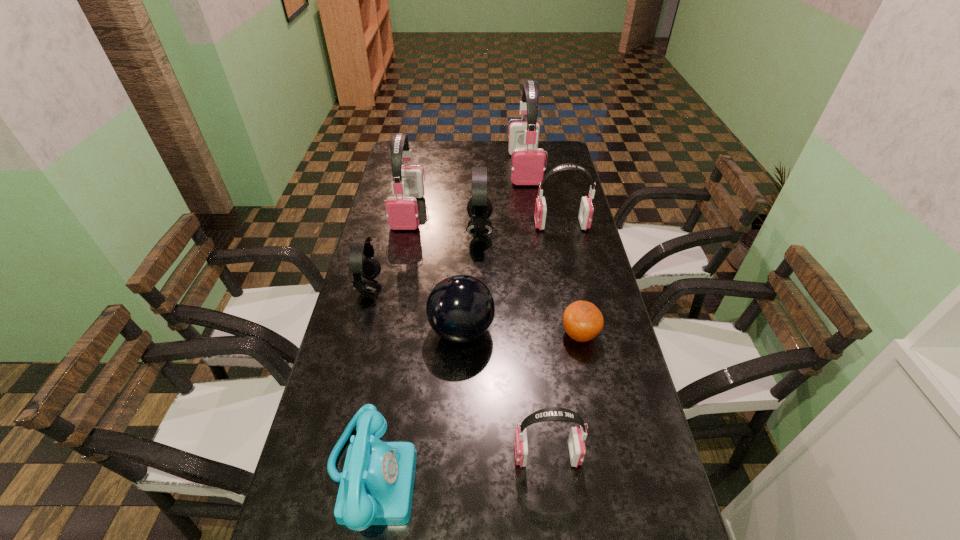
Find the location of a particular element. The height and width of the screenshot is (540, 960). vacant space at the left edge of the desktop is located at coordinates (337, 401).

In the image, there is a desktop. Identify the location of vacant space at the right edge. (611, 356).

Where is `free spot at the far left corner of the desktop`? The image size is (960, 540). free spot at the far left corner of the desktop is located at coordinates (410, 144).

Identify the location of free spot at the far right corner of the desktop. [x=556, y=167].

Identify the location of unoccupied area between the fifth farthest object and the nearest earphone. (458, 371).

Where is `free space between the third earphone from left to right and the eighth shortest object`? free space between the third earphone from left to right and the eighth shortest object is located at coordinates (444, 221).

At what (x,y) coordinates should I click in order to perform the action: click on vacant space in between the shortest object and the second smallest pink earphone. Please return your answer as a coordinate pair (x, y). Looking at the image, I should click on (570, 280).

The height and width of the screenshot is (540, 960). I want to click on vacant point located between the farther black earphone and the biggest pink earphone, so click(x=502, y=199).

Identify the location of free spot between the second smallest pink earphone and the biggest pink earphone. This screenshot has width=960, height=540. (543, 197).

At what (x,y) coordinates should I click in order to perform the action: click on vacant area that lies between the left black earphone and the bowling ball. Please return your answer as a coordinate pair (x, y). The height and width of the screenshot is (540, 960). Looking at the image, I should click on (416, 309).